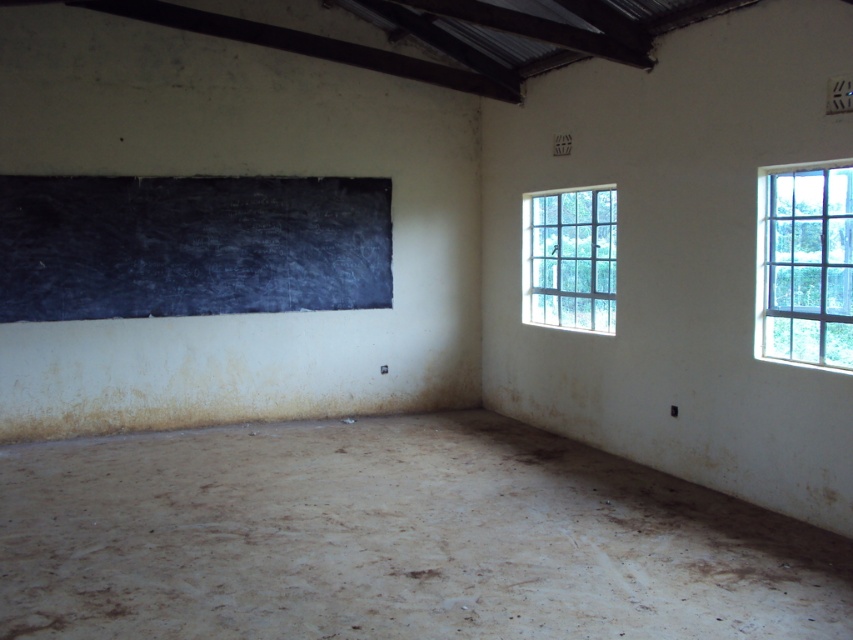
You are standing in the classroom and see two points marked on the wall. The first point is at coordinates point (813, 196) and the second is at point (614, 268). Which point is closer to you?

Point (813, 196) is in front of point (614, 268), so it is closer to you.

You are a teacher who needs to write an important announcement. You have a choice between the black chalkboard at upper left and the clear glass window at upper right. Which surface is wider and thus better suited for writing a longer message?

The black chalkboard at upper left is wider than the clear glass window at upper right, making it better suited for writing a longer message.

You are a student sitting in the classroom and want to look outside. You notice two clear glass windows. Which window is located lower on the wall, the clear glass window at upper right or the clear glass window at right?

The clear glass window at upper right is positioned under the clear glass window at right, meaning the clear glass window at upper right is actually lower on the wall than the clear glass window at right.